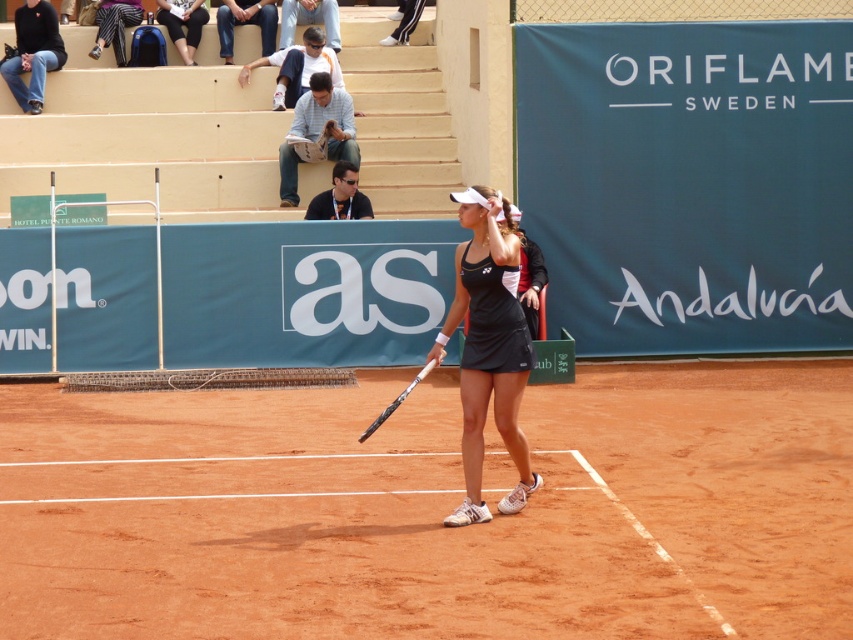
You are a tennis ball that just landed on the court. Which surface will you first touch between the brown clay tennis court at center and the white glossy tennis racket at center?

The brown clay tennis court at center is in front of the white glossy tennis racket at center, so the tennis ball will first touch the brown clay tennis court at center.

You are a photographer positioned at the baseline of the clay court. You want to capture a photo that includes both the black matte tennis skirt at center and the white glossy tennis racket at center. Which object should you focus on first if you want to ensure both are in frame?

The black matte tennis skirt at center is to the right of the white glossy tennis racket at center. To include both in the frame, focus on the white glossy tennis racket at center first since it is on the left side, then adjust to include the black matte tennis skirt at center on the right.

You are a photographer trying to capture the perfect shot of the tennis player. You need to ensure that both the black matte tennis skirt at center and the white glossy tennis racket at center are clearly visible in the frame. Considering their sizes, which object might require more careful framing to avoid being too small in the photo?

The white glossy tennis racket at center might require more careful framing because its width is smaller than the black matte tennis skirt at center, so it could appear too small if not positioned properly.